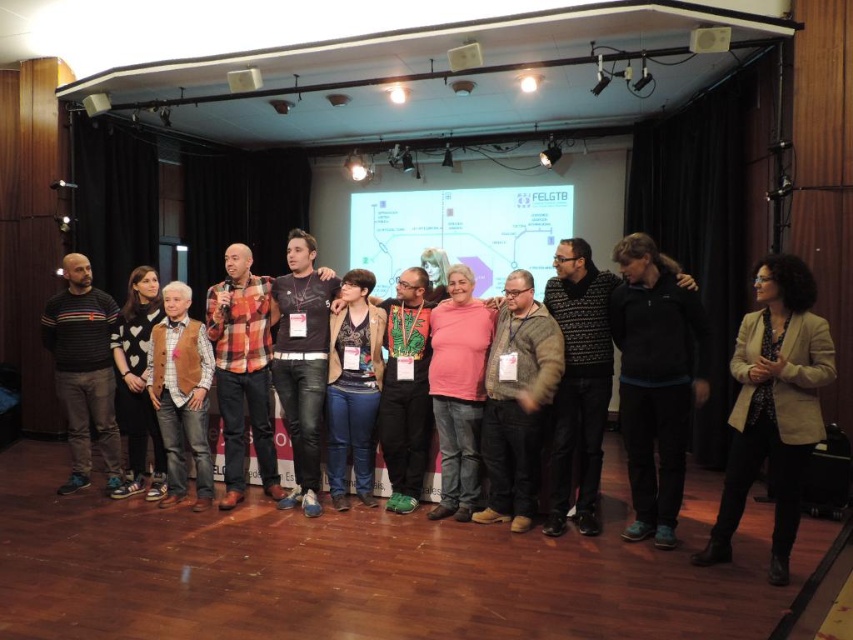
Describe the element at coordinates (656, 380) in the screenshot. I see `black fleece jacket at center` at that location.

Who is positioned more to the left, black fleece jacket at center or white matte projection screen at center?

white matte projection screen at center is more to the left.

Which is behind, point (653, 328) or point (485, 260)?

The point (485, 260) is behind.

This screenshot has height=640, width=853. In order to click on black fleece jacket at center in this screenshot , I will do `click(656, 380)`.

In the scene shown: Can you confirm if black fleece jacket at center is positioned to the left of blue jeans at center?

Incorrect, black fleece jacket at center is not on the left side of blue jeans at center.

Does black fleece jacket at center appear on the right side of blue jeans at center?

Correct, you'll find black fleece jacket at center to the right of blue jeans at center.

At what (x,y) coordinates should I click in order to perform the action: click on black fleece jacket at center. Please return your answer as a coordinate pair (x, y). The height and width of the screenshot is (640, 853). Looking at the image, I should click on (656, 380).

Is black fleece jacket at center further to the viewer compared to white sweater at left?

No, black fleece jacket at center is in front of white sweater at left.

Which is in front, point (628, 442) or point (136, 362)?

Positioned in front is point (628, 442).

Based on the photo, who is more distant from viewer, [670,492] or [144,333]?

Point [144,333]

This screenshot has width=853, height=640. I want to click on black fleece jacket at center, so click(x=656, y=380).